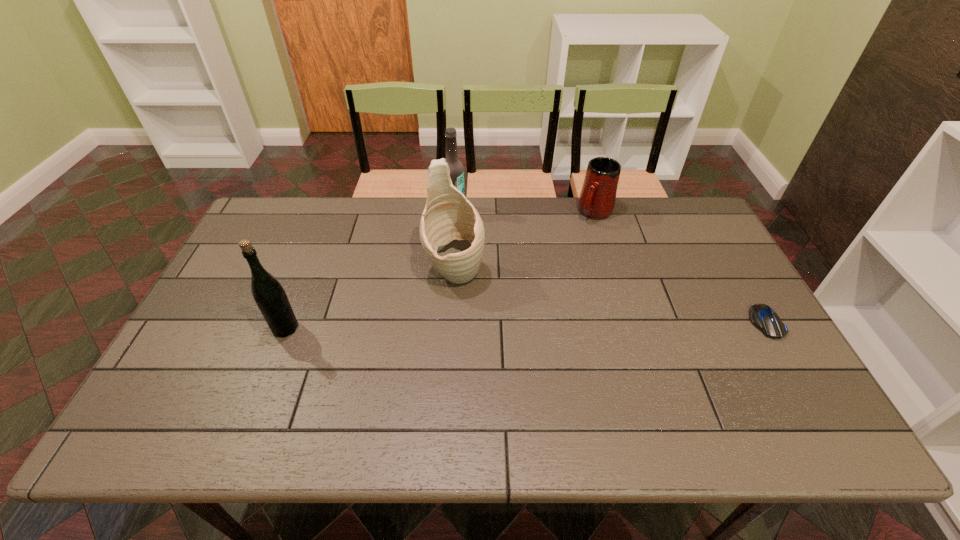
Where is `beer bottle that is at the far edge`? beer bottle that is at the far edge is located at coordinates (456, 168).

Locate an element on the screen. mug that is at the far edge is located at coordinates (597, 199).

Where is `object situated at the right edge`? This screenshot has width=960, height=540. object situated at the right edge is located at coordinates (763, 317).

The image size is (960, 540). In the image, there is a desktop. What are the coordinates of `free space at the far edge` in the screenshot? It's located at (407, 224).

In the image, there is a desktop. Identify the location of vacant region at the left edge. (248, 274).

You are a GUI agent. You are given a task and a screenshot of the screen. Output one action in this format:
    pyautogui.click(x=<x>, y=<y>)
    Task: Click on the free space at the right edge of the desktop
    The image size is (960, 540).
    Given the screenshot: What is the action you would take?
    pyautogui.click(x=746, y=332)

Locate an element on the screen. The width and height of the screenshot is (960, 540). free space at the far right corner of the desktop is located at coordinates (685, 230).

The height and width of the screenshot is (540, 960). I want to click on free space between the right beer bottle and the computer mouse, so click(x=610, y=266).

Locate an element on the screen. unoccupied area between the pitcher and the leftmost object is located at coordinates (370, 300).

The image size is (960, 540). In order to click on free point between the left beer bottle and the rightmost object in this screenshot , I will do `click(525, 325)`.